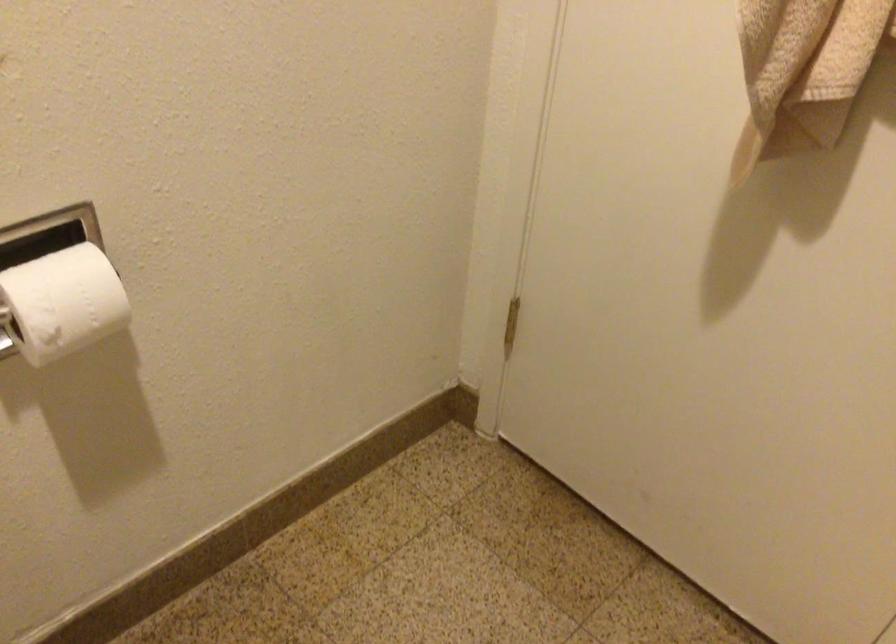
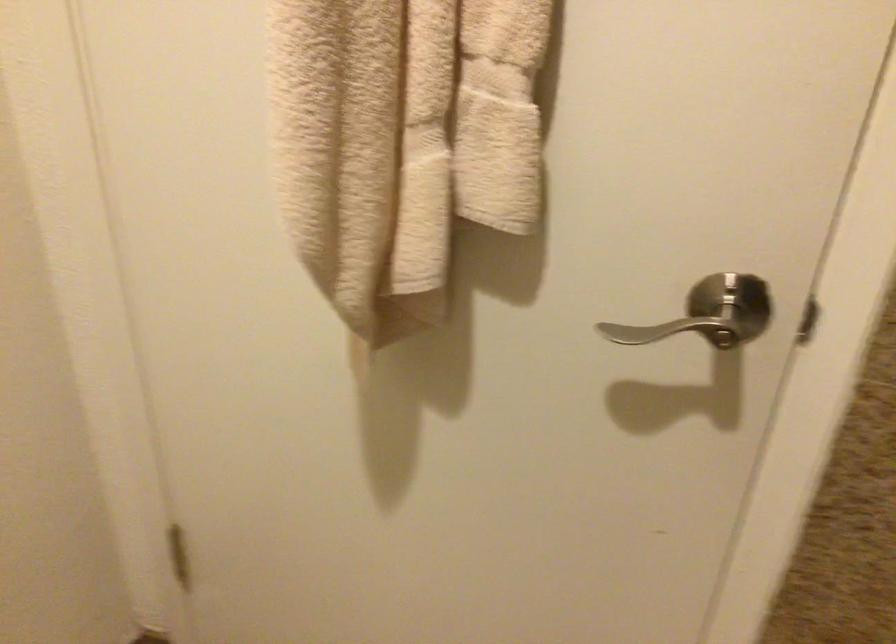
In a continuous first-person perspective shot, in which direction is the camera moving?

The cameraman moved toward right, forward.